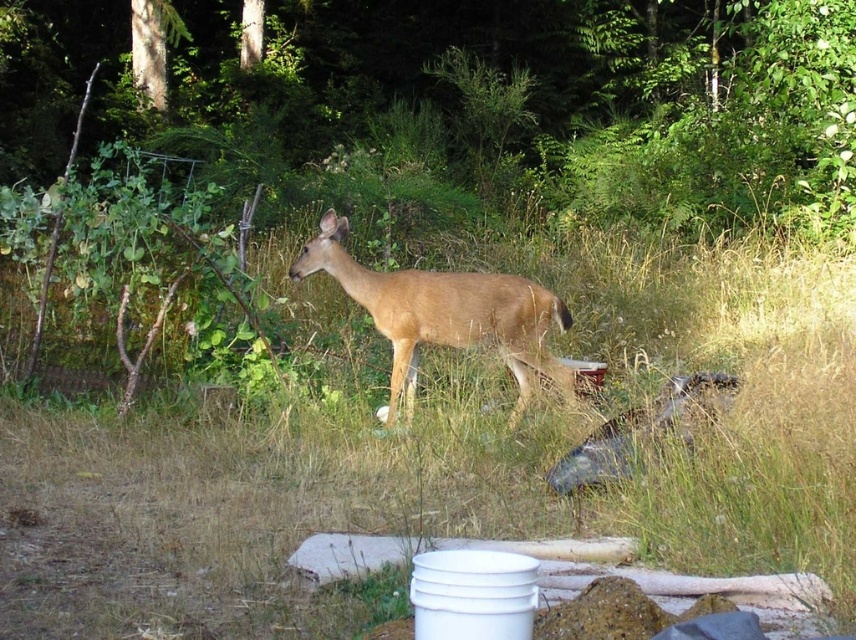
Where is the green grass at center located in the image?

The green grass at center is located at point 0.719 in the x coordinate and 0.525 in the y coordinate.